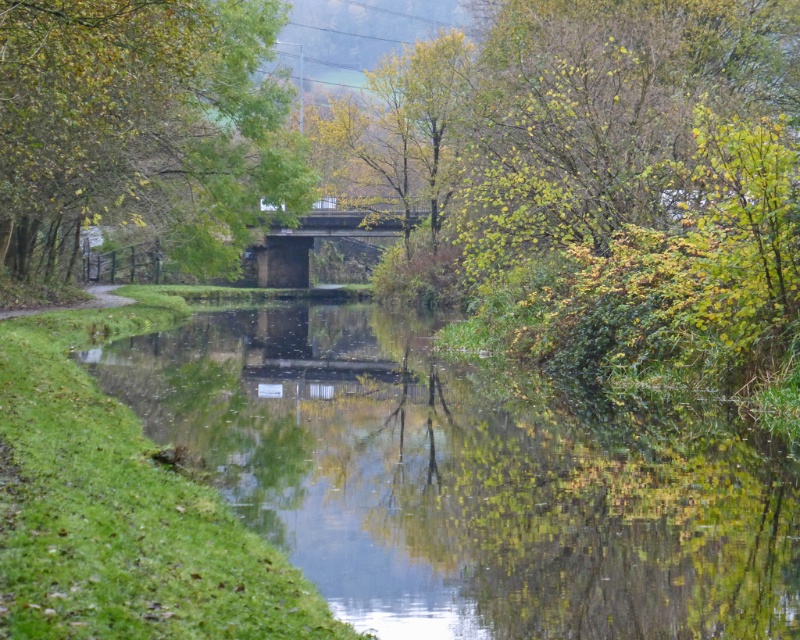
You are standing on the bank of the waterway and want to cross to the other side. You see the clear water at center and the concrete bridge at center. Which one is closer to you?

The clear water at center is closer to the viewer than the concrete bridge at center, so the clear water at center is closer to you.

You are standing at the point marked as point (x=468, y=481) in the image. What do you see directly beneath your feet?

You see clear water at center beneath your feet at point (x=468, y=481).

You are standing on the bank of the waterway and want to take a photo that includes both the green leafy tree at center and the concrete bridge at center. Which object should you frame first in your camera to ensure both are fully visible?

You should frame the green leafy tree at center first because it has a larger size compared to the concrete bridge at center, so ensuring it fits properly will help accommodate the smaller bridge in the frame.